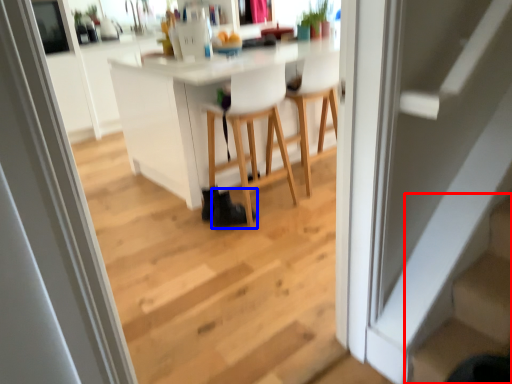
Question: Among these objects, which one is farthest to the camera, stairs (highlighted by a red box) or shoe (highlighted by a blue box)?

Choices:
 (A) stairs
 (B) shoe

Answer: (B)